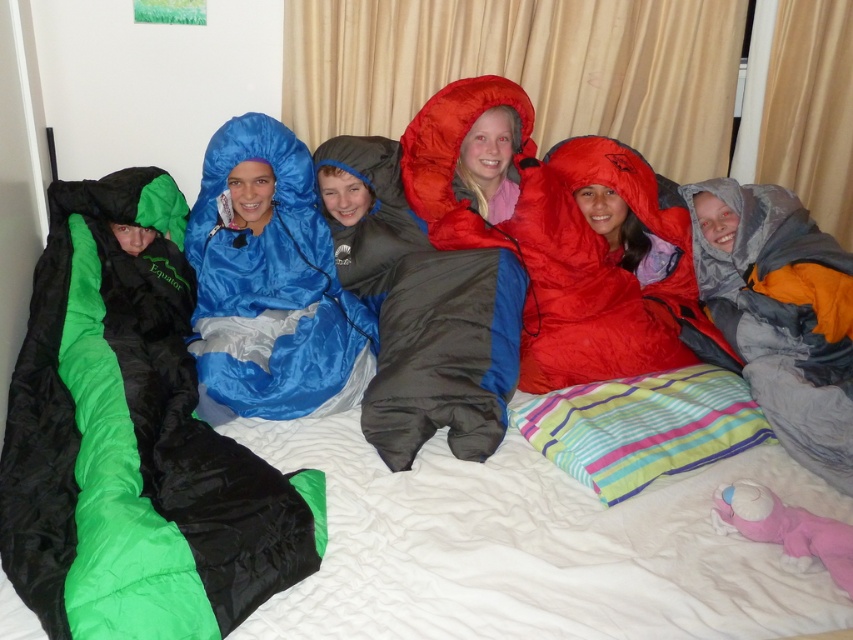
Question: Does black/green nylon sleeping bag at left have a lesser width compared to gray fabric raincoat at right?

Choices:
 (A) no
 (B) yes

Answer: (A)

Question: Does black/green nylon sleeping bag at left appear on the right side of gray fabric raincoat at right?

Choices:
 (A) yes
 (B) no

Answer: (B)

Question: Among these points, which one is farthest from the camera?

Choices:
 (A) (801, 456)
 (B) (177, 454)

Answer: (A)

Question: Which point is closer to the camera?

Choices:
 (A) (821, 300)
 (B) (51, 230)

Answer: (A)

Question: Does black/green nylon sleeping bag at left appear over gray fabric raincoat at right?

Choices:
 (A) no
 (B) yes

Answer: (A)